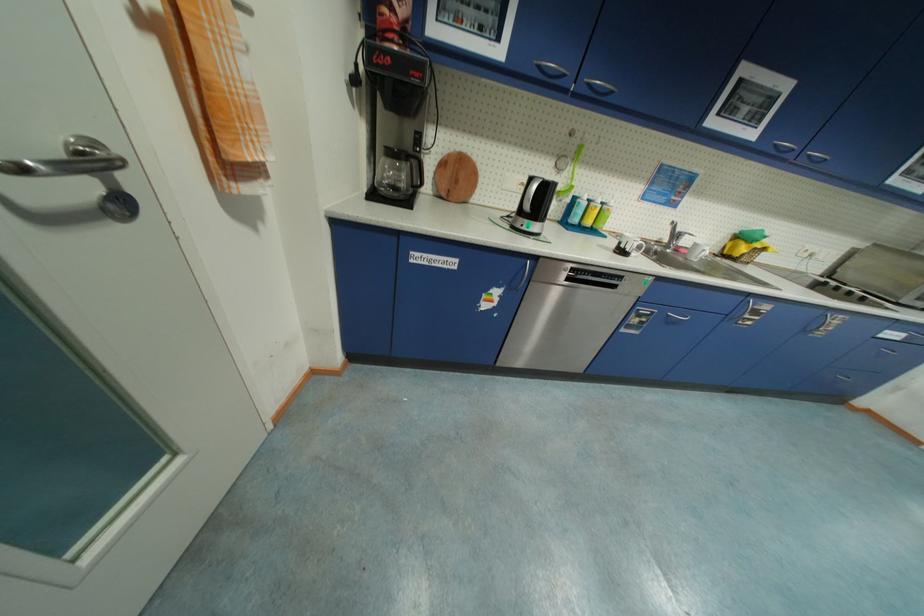
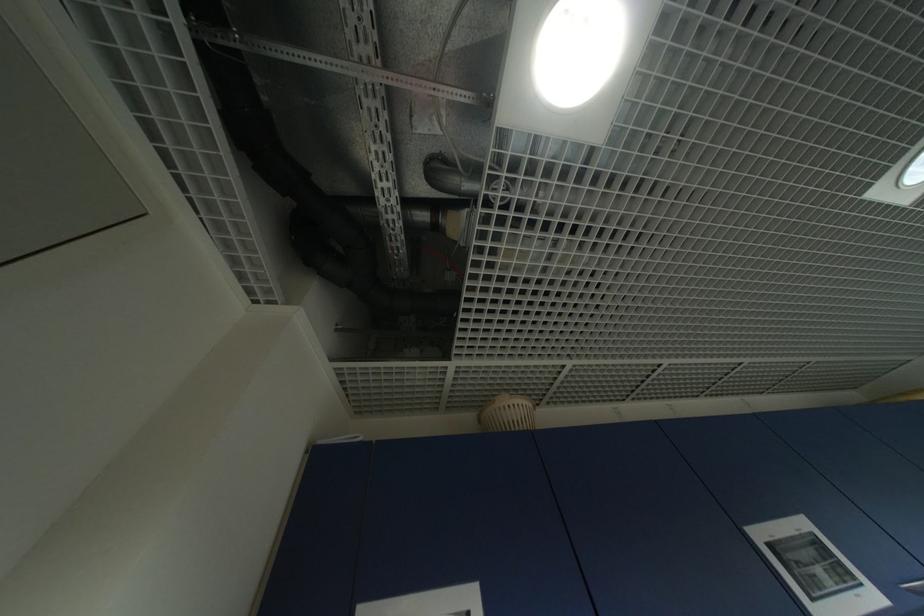
First-person continuous shooting, in which direction is the camera rotating?

The rotation direction of the camera is right-up.